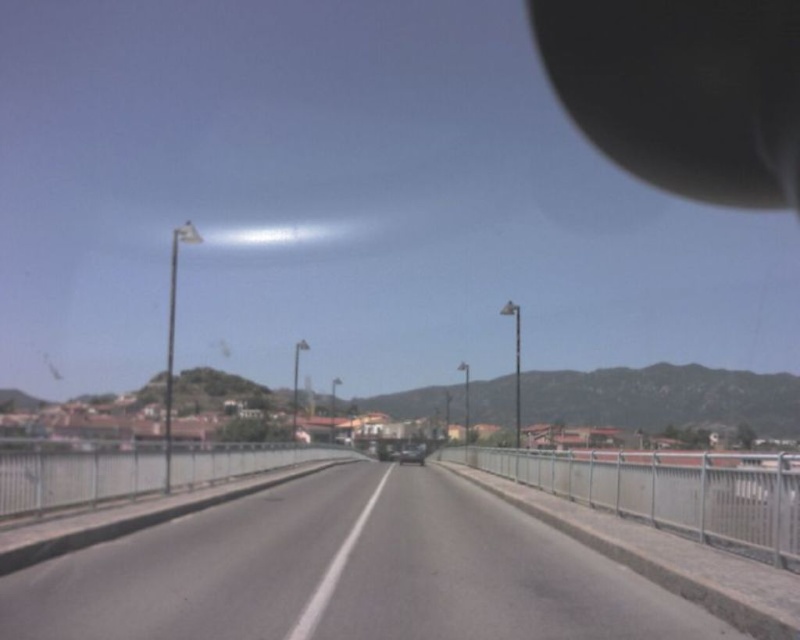
You are driving a car and want to check your blind spot. The matte black view mirror at upper right is located at point (684, 90). Is this point on the driver side or passenger side of the car?

The matte black view mirror at upper right is located at point (684, 90), which is on the passenger side of the car.

You are a self driving car navigating the road. Your GPS says you need to stay on the gray asphalt highway at center. According to the map, the highway is located at point 0.895, 0.435. Is your current position correct?

Yes, the gray asphalt highway at center is located at point (348,572), so your current position is correct.

You are driving a car and need to check your side mirror. The matte black view mirror at upper right and the metallic silver car at center are both visible in your field of view. Which object is wider?

The matte black view mirror at upper right is wider than the metallic silver car at center.